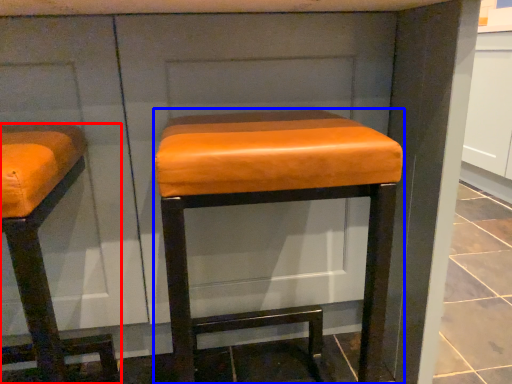
Question: Which object appears closest to the camera in this image, furniture (highlighted by a red box) or stool (highlighted by a blue box)?

Choices:
 (A) furniture
 (B) stool

Answer: (A)